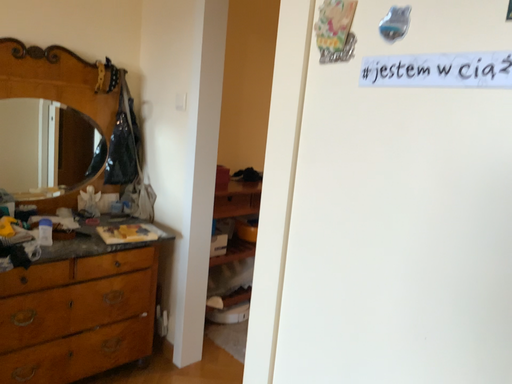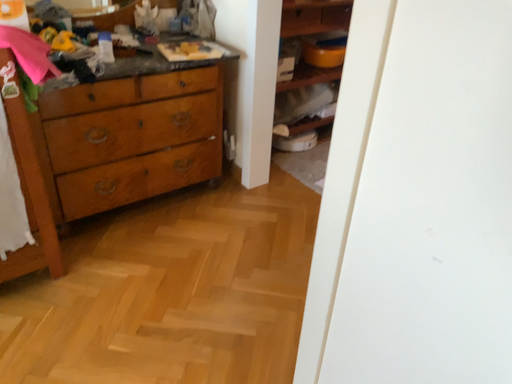
Question: How did the camera likely rotate when shooting the video?

Choices:
 (A) rotated right
 (B) rotated left

Answer: (B)